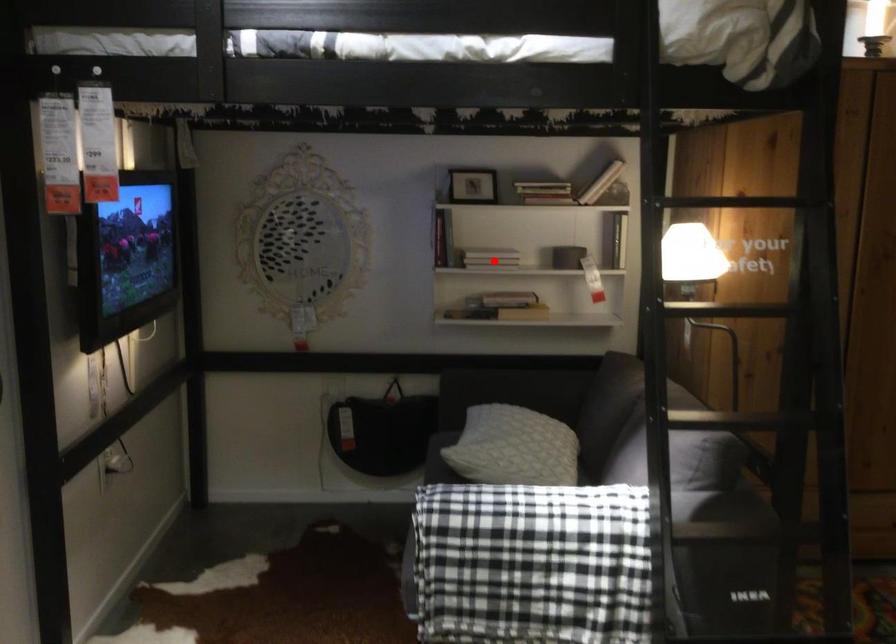
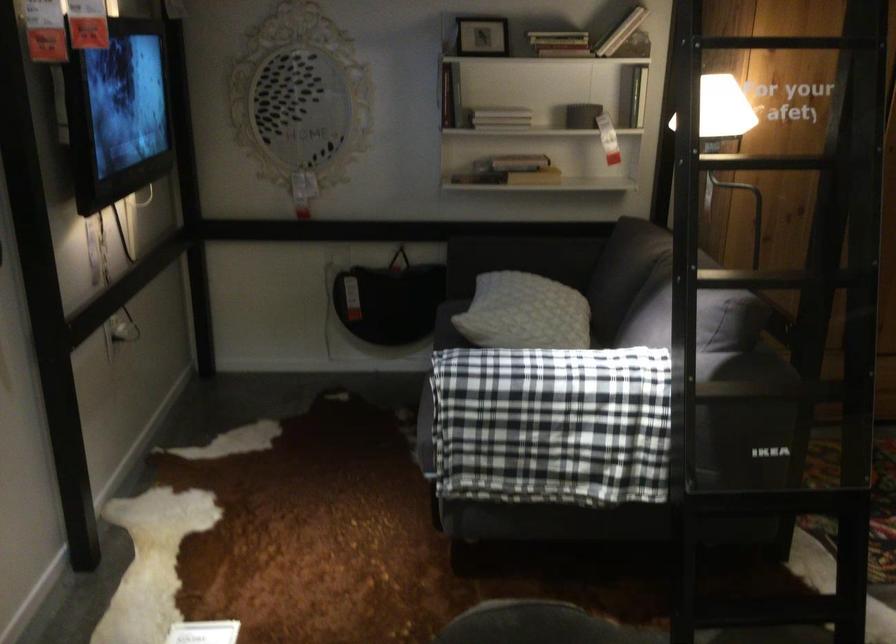
Question: I am providing you with two images of the same scene from different viewpoints. A red point is marked on the first image. Can you still see the location of the red point in image 2?

Choices:
 (A) Yes
 (B) No

Answer: (A)